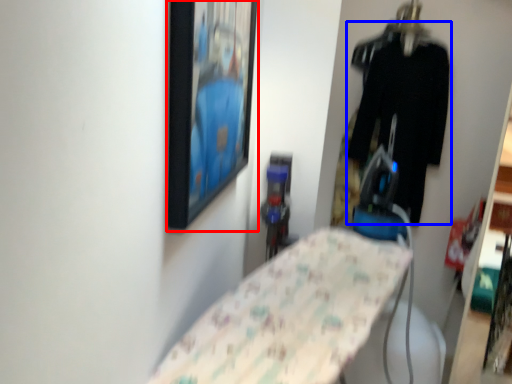
Question: Which of the following is the farthest to the observer, picture frame (highlighted by a red box) or clothing (highlighted by a blue box)?

Choices:
 (A) picture frame
 (B) clothing

Answer: (B)